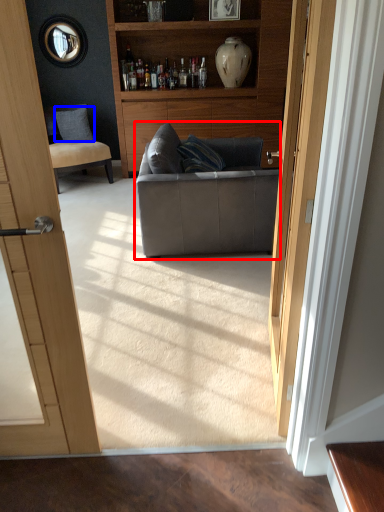
Question: Which of the following is the closest to the observer, studio couch (highlighted by a red box) or pillow (highlighted by a blue box)?

Choices:
 (A) studio couch
 (B) pillow

Answer: (A)